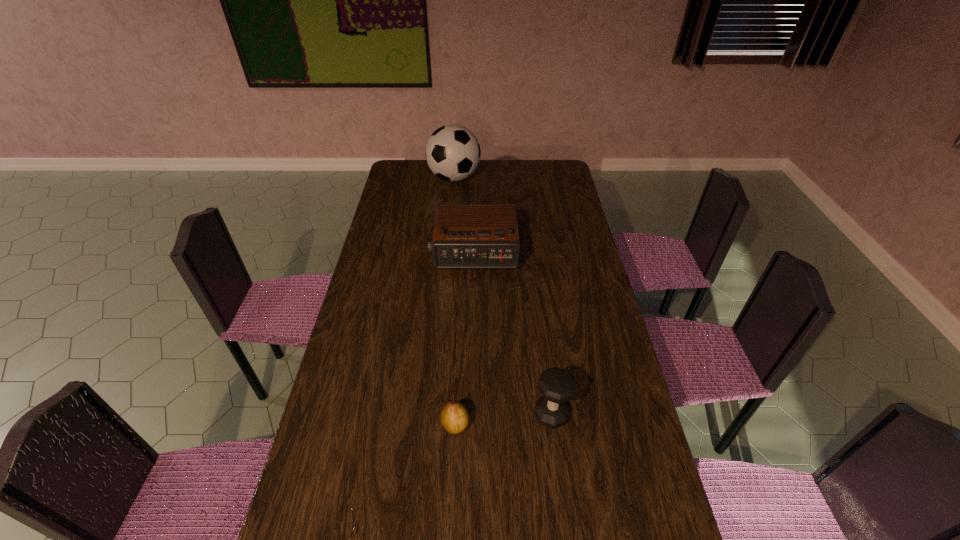
At what (x,y) coordinates should I click in order to perform the action: click on the farthest object. Please return your answer as a coordinate pair (x, y). This screenshot has width=960, height=540. Looking at the image, I should click on (453, 153).

Locate an element on the screen. This screenshot has height=540, width=960. soccer ball is located at coordinates (453, 153).

The width and height of the screenshot is (960, 540). I want to click on the third nearest object, so click(466, 236).

At what (x,y) coordinates should I click in order to perform the action: click on the rightmost object. Please return your answer as a coordinate pair (x, y). Looking at the image, I should click on (557, 386).

Identify the location of pear. (454, 417).

Locate an element on the screen. free space located on the front of the tallest object is located at coordinates (450, 231).

Locate an element on the screen. vacant area located 0.170m on the front panel of the radio receiver is located at coordinates (472, 309).

Find the location of a particular element. The width and height of the screenshot is (960, 540). free point located 0.170m on the front of the dumbbell is located at coordinates (562, 498).

You are a GUI agent. You are given a task and a screenshot of the screen. Output one action in this format:
    pyautogui.click(x=<x>, y=<y>)
    Task: Click on the vacant position located 0.350m on the back of the shortest object
    This screenshot has height=540, width=960.
    Given the screenshot: What is the action you would take?
    pyautogui.click(x=460, y=316)

You are a GUI agent. You are given a task and a screenshot of the screen. Output one action in this format:
    pyautogui.click(x=<x>, y=<y>)
    Task: Click on the object at the far edge
    The height and width of the screenshot is (540, 960).
    Given the screenshot: What is the action you would take?
    pyautogui.click(x=453, y=153)